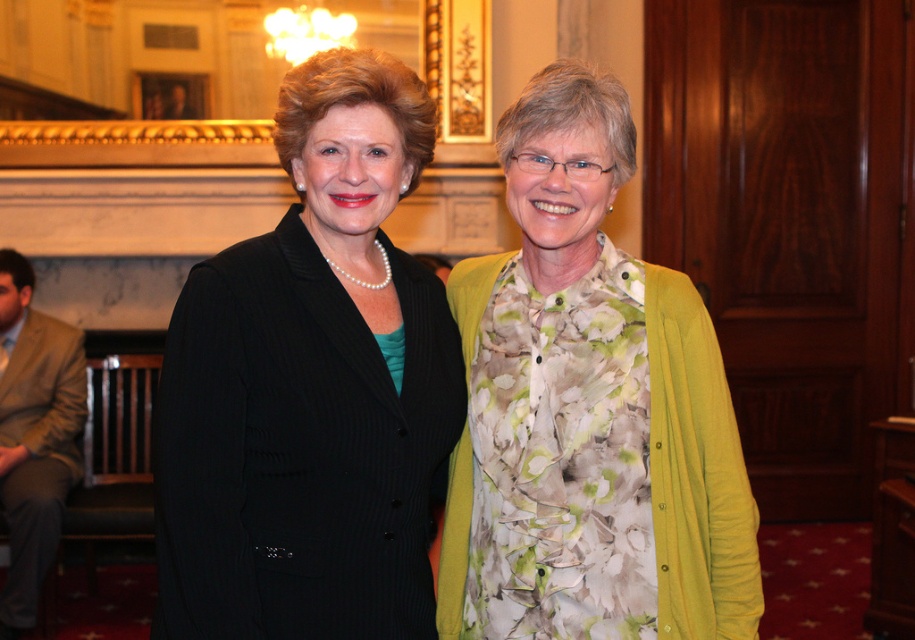
Is black textured blazer at center above tan fabric suit at left?

Yes, black textured blazer at center is above tan fabric suit at left.

Who is positioned more to the right, black textured blazer at center or tan fabric suit at left?

From the viewer's perspective, black textured blazer at center appears more on the right side.

Which is in front, point (188, 600) or point (18, 264)?

Point (188, 600) is more forward.

Image resolution: width=915 pixels, height=640 pixels. Identify the location of black textured blazer at center. (311, 387).

Can you confirm if black textured blazer at center is positioned above floral fabric dress at center?

Correct, black textured blazer at center is located above floral fabric dress at center.

Can you confirm if black textured blazer at center is positioned to the left of floral fabric dress at center?

Correct, you'll find black textured blazer at center to the left of floral fabric dress at center.

This screenshot has height=640, width=915. What do you see at coordinates (311, 387) in the screenshot?
I see `black textured blazer at center` at bounding box center [311, 387].

You are a GUI agent. You are given a task and a screenshot of the screen. Output one action in this format:
    pyautogui.click(x=<x>, y=<y>)
    Task: Click on the black textured blazer at center
    The width and height of the screenshot is (915, 640).
    Given the screenshot: What is the action you would take?
    pyautogui.click(x=311, y=387)

Does floral fabric dress at center appear under tan fabric suit at left?

No.

The width and height of the screenshot is (915, 640). What do you see at coordinates (589, 410) in the screenshot?
I see `floral fabric dress at center` at bounding box center [589, 410].

The width and height of the screenshot is (915, 640). I want to click on floral fabric dress at center, so click(x=589, y=410).